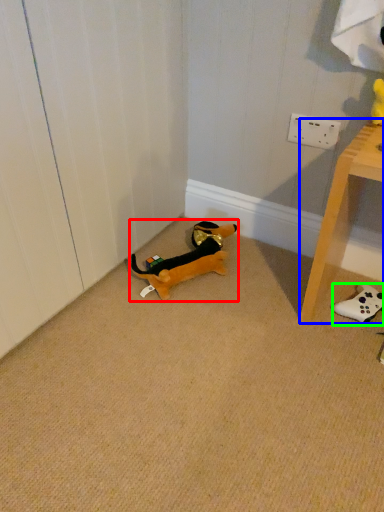
Question: Which object is positioned farthest from toy (highlighted by a red box)? Select from furniture (highlighted by a blue box) and toy (highlighted by a green box).

Choices:
 (A) furniture
 (B) toy

Answer: (B)